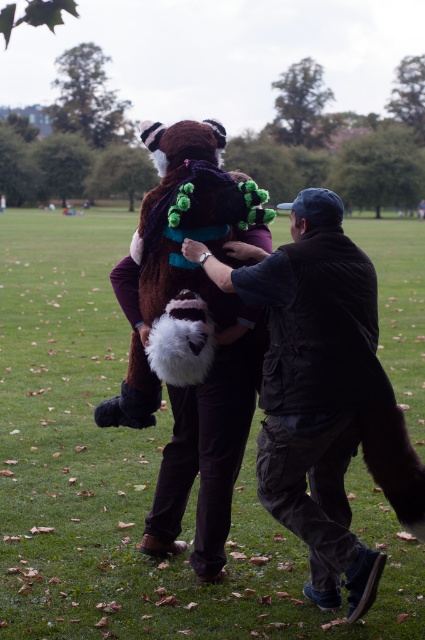
Question: Does dark brown leather jacket at center have a greater width compared to brown plush animal at center?

Choices:
 (A) no
 (B) yes

Answer: (B)

Question: Which point is farther to the camera?

Choices:
 (A) (334, 500)
 (B) (254, 211)

Answer: (B)

Question: Is dark brown leather jacket at center above brown plush animal at center?

Choices:
 (A) yes
 (B) no

Answer: (B)

Question: Can you confirm if dark brown leather jacket at center is positioned above brown plush animal at center?

Choices:
 (A) yes
 (B) no

Answer: (B)